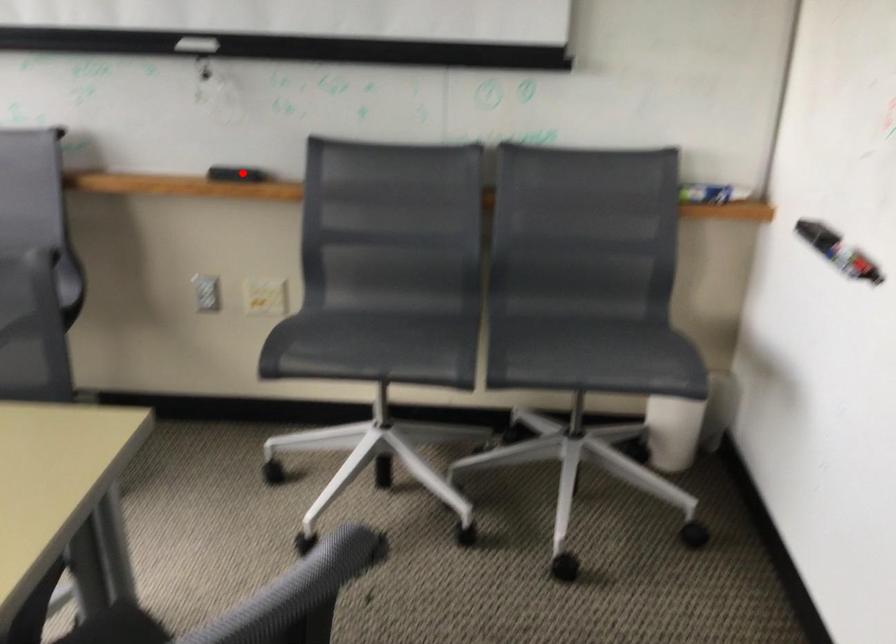
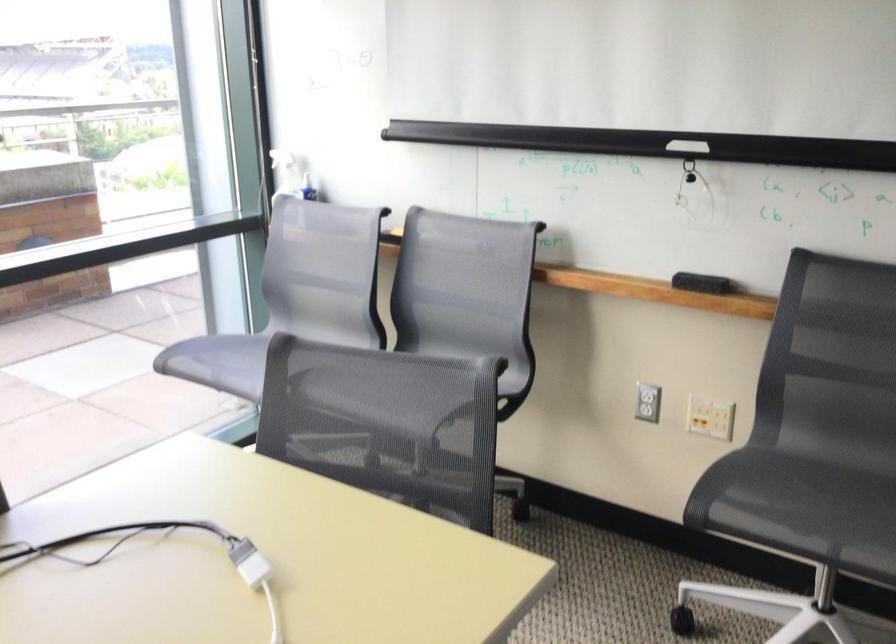
Find the pixel in the second image that matches the highlighted location in the first image.

(701, 283)